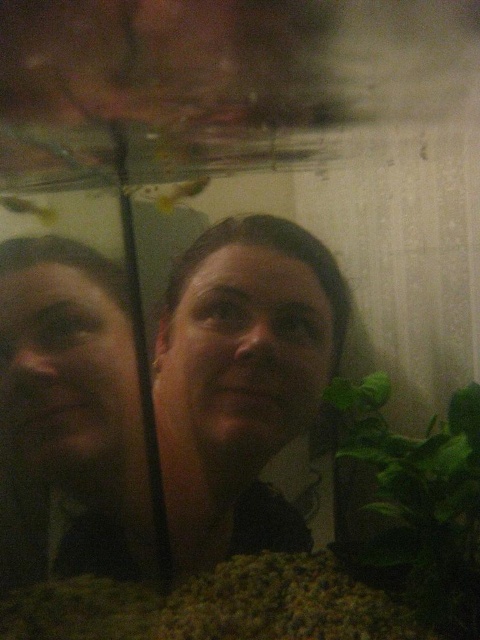
Based on the photo, you are a photographer trying to capture the reflection of the person in the fish tank. You notice a point marked at coordinates [241,380] in the image. What object is located at this point?

The point at coordinates [241,380] marks the matte black hair at center.

You are a photographer trying to capture a clear shot of the matte black hair at center and the green leafy plant at lower right. Based on their positions, which object is wider in the image?

The matte black hair at center might be wider than green leafy plant at lower right according to the description.

You are a snorkeler trying to touch your matte black hair at center while staying exactly 1.44 meters away from it. Can you reach it without moving closer?

The matte black hair at center and viewer are 1.44 meters apart, so if you can reach 1.44 meters, you can touch it without moving closer.